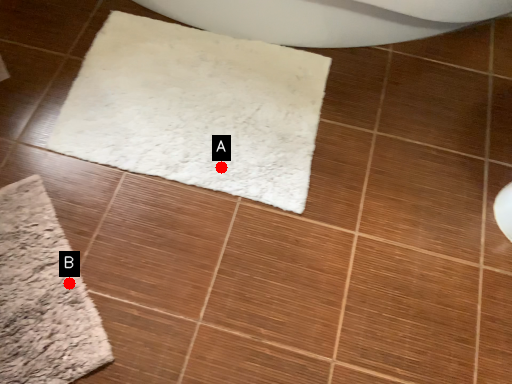
Question: Two points are circled on the image, labeled by A and B beside each circle. Among these points, which one is nearest to the camera?

Choices:
 (A) A is closer
 (B) B is closer

Answer: (B)